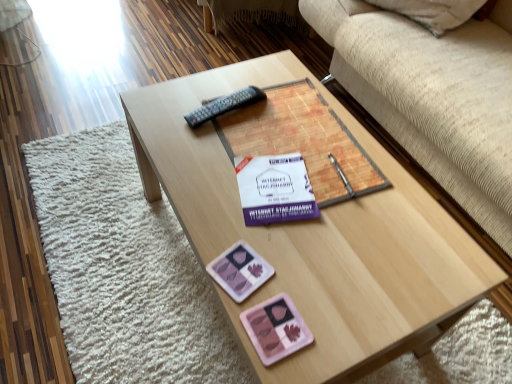
At what (x,y) coordinates should I click in order to perform the action: click on free spot behind pink matte palette at center, which ranks as the second currency in top-to-bottom order. Please return your answer as a coordinate pair (x, y). The width and height of the screenshot is (512, 384). Looking at the image, I should click on point(287,257).